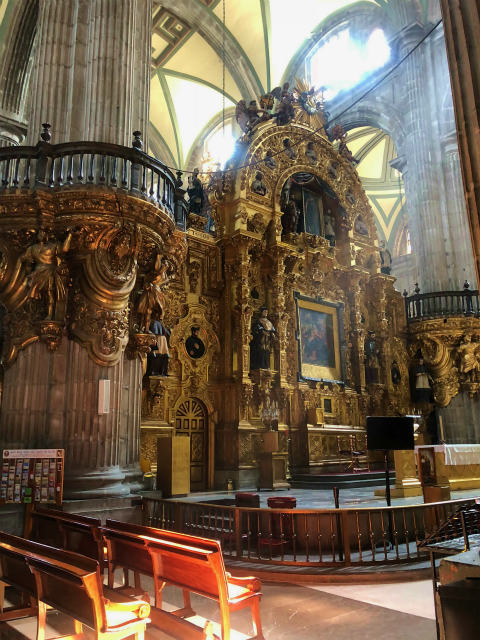
Identify the location of pew. The height and width of the screenshot is (640, 480). (48, 576), (155, 540), (55, 527).